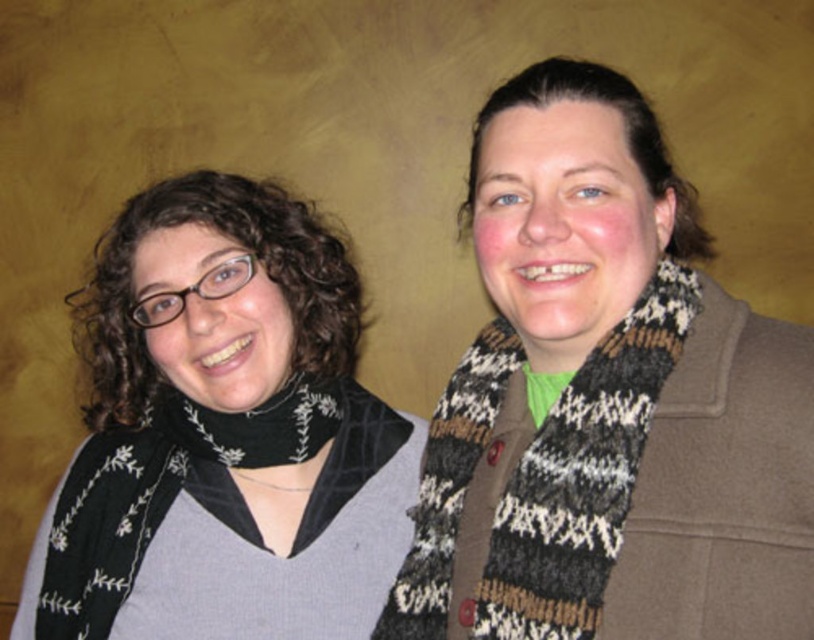
Question: Where is knitted scarf at center located in relation to black knitted scarf at left in the image?

Choices:
 (A) right
 (B) left

Answer: (A)

Question: Which object is closer to the camera taking this photo?

Choices:
 (A) knitted wool scarf at right
 (B) black knitted scarf at left

Answer: (A)

Question: Can you confirm if knitted scarf at center is wider than black knitted scarf at left?

Choices:
 (A) no
 (B) yes

Answer: (A)

Question: Among these points, which one is nearest to the camera?

Choices:
 (A) (641, 394)
 (B) (541, 604)
 (C) (198, 472)

Answer: (B)

Question: Does knitted scarf at center have a smaller size compared to black knitted scarf at left?

Choices:
 (A) yes
 (B) no

Answer: (A)

Question: Considering the real-world distances, which object is farthest from the knitted wool scarf at right?

Choices:
 (A) black knitted scarf at left
 (B) knitted scarf at center

Answer: (A)